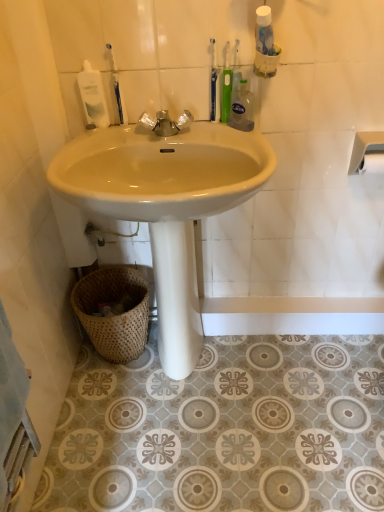
Identify the location of empty space that is to the right of matte silver faucet at center. (218, 135).